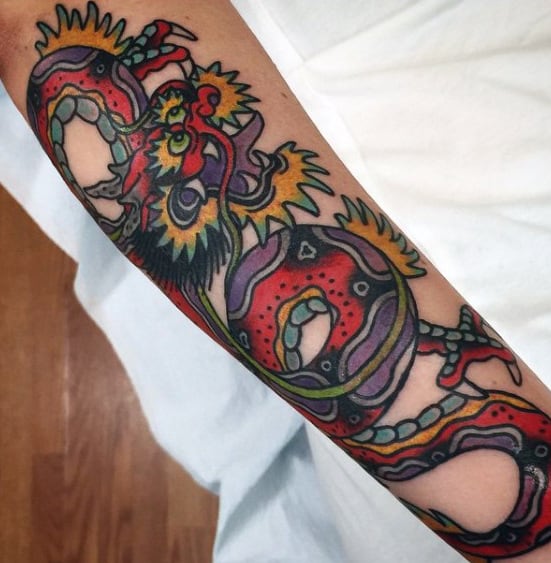
This screenshot has height=563, width=551. I want to click on bottom of wood floor, so click(x=0, y=561), click(x=54, y=562), click(x=127, y=560), click(x=209, y=558).